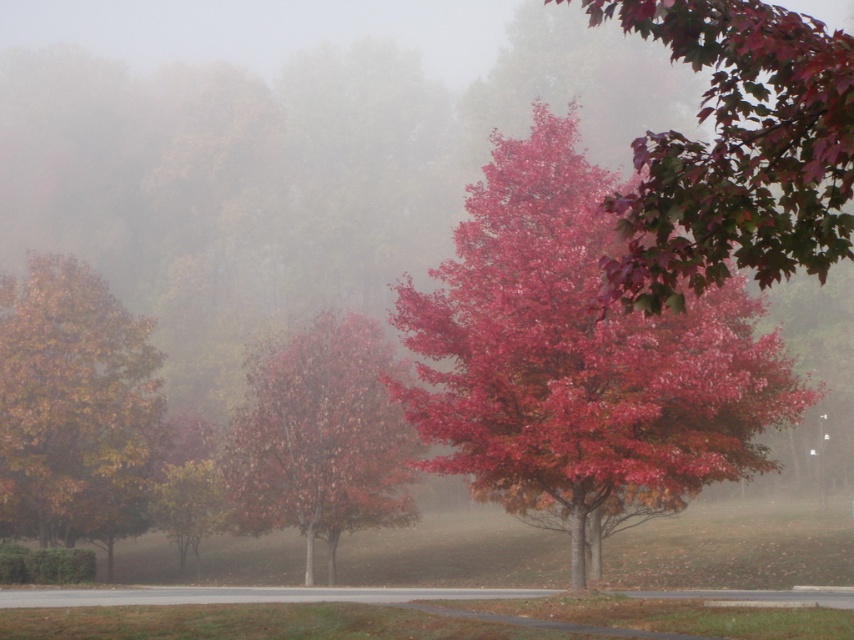
Which is below, shiny crimson leaves at center or glossy red leaves at upper right?

shiny crimson leaves at center

Is point (496, 365) farther from camera compared to point (689, 13)?

Yes, it is.

The height and width of the screenshot is (640, 854). I want to click on shiny crimson leaves at center, so click(x=578, y=358).

Who is higher up, yellowish-brown wood tree at left or glossy red tree at center?

Result: yellowish-brown wood tree at left

Is yellowish-brown wood tree at left smaller than glossy red tree at center?

Indeed, yellowish-brown wood tree at left has a smaller size compared to glossy red tree at center.

Describe the element at coordinates (74, 406) in the screenshot. Image resolution: width=854 pixels, height=640 pixels. I see `yellowish-brown wood tree at left` at that location.

Where is `yellowish-brown wood tree at left`? The image size is (854, 640). yellowish-brown wood tree at left is located at coordinates (74, 406).

Between glossy red leaves at upper right and glossy red tree at center, which one is positioned lower?

glossy red tree at center is below.

Does point (812, 180) come farther from viewer compared to point (250, 513)?

That is False.

Is point (764, 196) more distant than point (264, 497)?

No, it is not.

Locate an element on the screen. glossy red leaves at upper right is located at coordinates (736, 150).